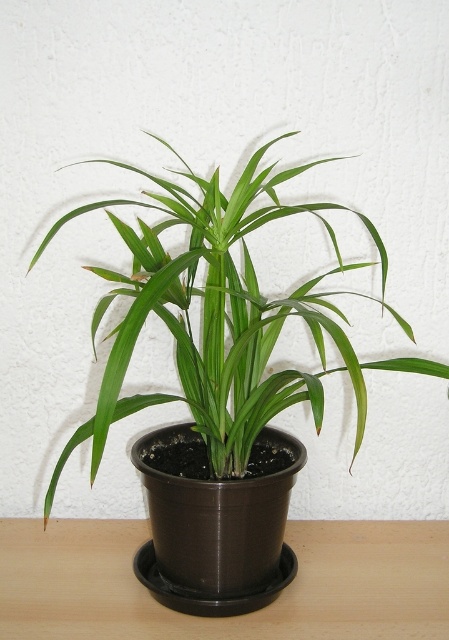
You are standing in a room and see the green matte plant at center and the brown wooden table at center. Which object is closer to you?

The green matte plant at center is closer to you because it is in front of the brown wooden table at center.

You are arranging items on a brown wooden table at center. You have a green matte plant at center that you want to place on the table. Based on their sizes, will the plant fit on the table without overhanging the edges?

The green matte plant at center is thinner than the brown wooden table at center, so it will fit on the table without overhanging the edges.